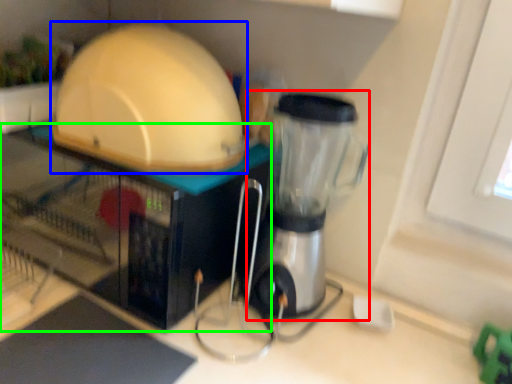
Question: Estimate the real-world distances between objects in this image. Which object is farther from blender (highlighted by a red box), appliance (highlighted by a blue box) or appliance (highlighted by a green box)?

Choices:
 (A) appliance
 (B) appliance

Answer: (B)